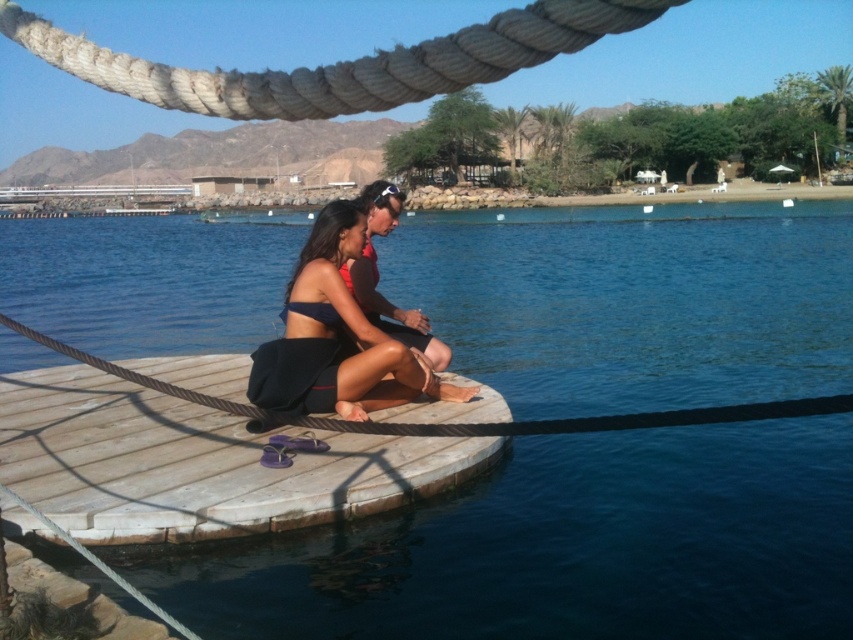
Describe the element at coordinates (564, 548) in the screenshot. The image size is (853, 640). I see `blue water at center` at that location.

Can you confirm if blue water at center is positioned to the right of matte black shorts at center?

No, blue water at center is not to the right of matte black shorts at center.

Between point (738, 621) and point (376, 232), which one is positioned in front?

Point (738, 621)

This screenshot has height=640, width=853. I want to click on blue water at center, so click(564, 548).

Is wooden dock at center shorter than rope at center?

No, wooden dock at center is not shorter than rope at center.

Is wooden dock at center positioned at the back of rope at center?

Yes.

Identify the location of wooden dock at center. The image size is (853, 640). (196, 452).

Which is above, blue water at center or wooden dock at center?

Positioned higher is blue water at center.

Who is more distant from viewer, (477, 598) or (340, 445)?

Positioned behind is point (340, 445).

Which is in front, point (846, 301) or point (15, 512)?

Positioned in front is point (15, 512).

The image size is (853, 640). Identify the location of blue water at center. [564, 548].